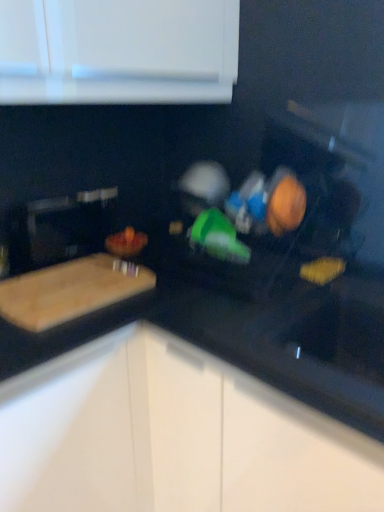
Where is `unoccupied space behind yellow matte sponge at lower right, which is the second food in front-to-back order`? unoccupied space behind yellow matte sponge at lower right, which is the second food in front-to-back order is located at coordinates (304, 260).